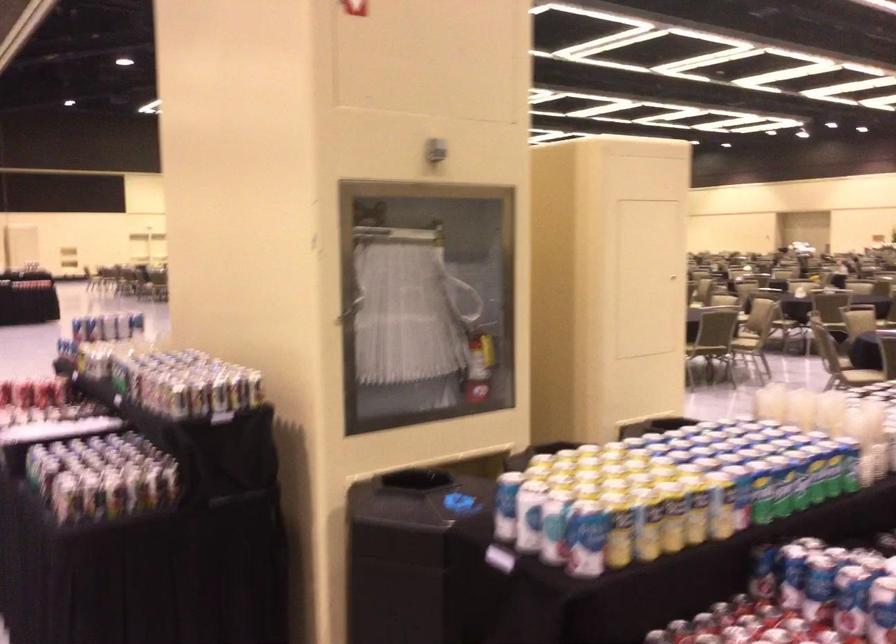
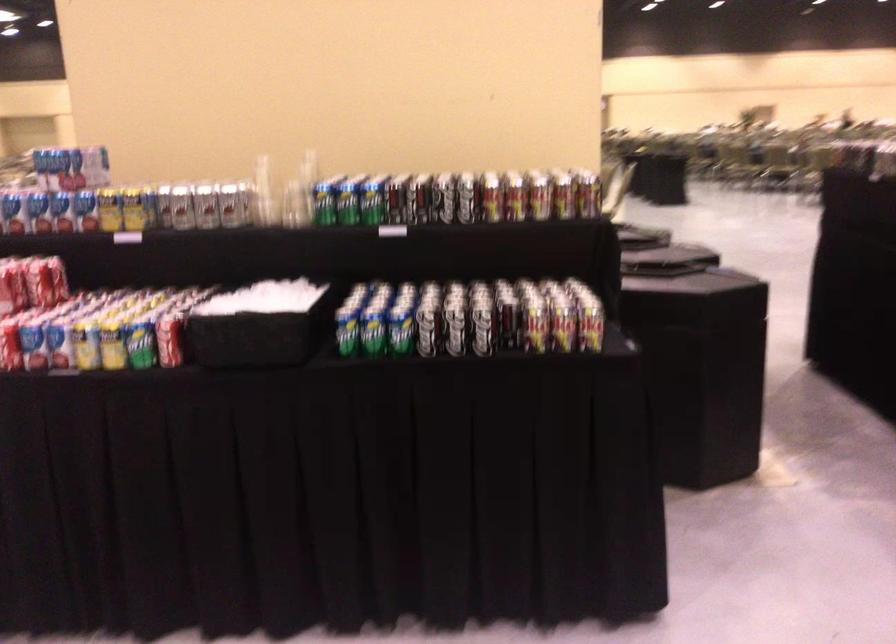
Question: I am providing you with two images of the same scene from different viewpoints. After the viewpoint changes to image2, which objects are now occluded?

Choices:
 (A) red folded towel
 (B) chair sitting surface
 (C) silver soda can
 (D) yellow soda can

Answer: (B)